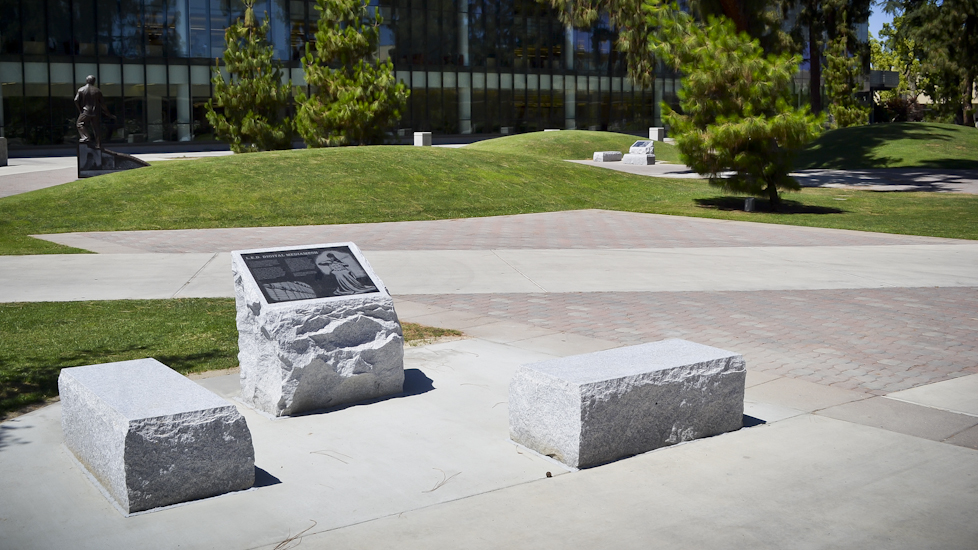
Where is `statue`? statue is located at coordinates (87, 97).